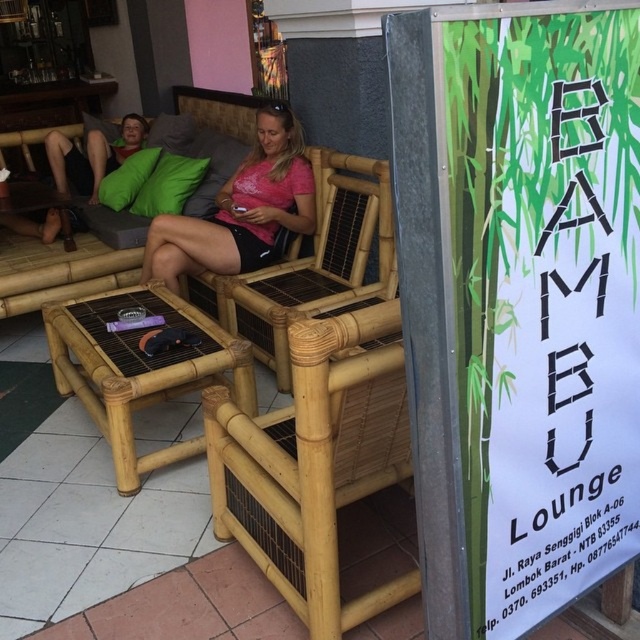
Can you confirm if bamboo woven chair at center is bigger than matte pink shirt at center?

Yes.

Can you confirm if bamboo woven chair at center is positioned to the left of matte pink shirt at center?

No, bamboo woven chair at center is not to the left of matte pink shirt at center.

Between point (216, 278) and point (196, 272), which one is positioned in front?

Point (216, 278) is in front.

The image size is (640, 640). I want to click on bamboo woven chair at center, so click(x=312, y=262).

Can you confirm if bamboo stool at center is wider than matte pink shirt at center?

Correct, the width of bamboo stool at center exceeds that of matte pink shirt at center.

Who is more forward, (x=124, y=371) or (x=168, y=275)?

Point (x=124, y=371) is in front.

This screenshot has height=640, width=640. I want to click on bamboo stool at center, so click(x=140, y=369).

Can you confirm if natural bamboo chair at center is smaller than matte pink shirt at center?

Yes, natural bamboo chair at center is smaller than matte pink shirt at center.

Can you confirm if natural bamboo chair at center is wider than matte pink shirt at center?

Incorrect, natural bamboo chair at center's width does not surpass matte pink shirt at center's.

Find the location of a particular element. Image resolution: width=640 pixels, height=640 pixels. natural bamboo chair at center is located at coordinates (316, 461).